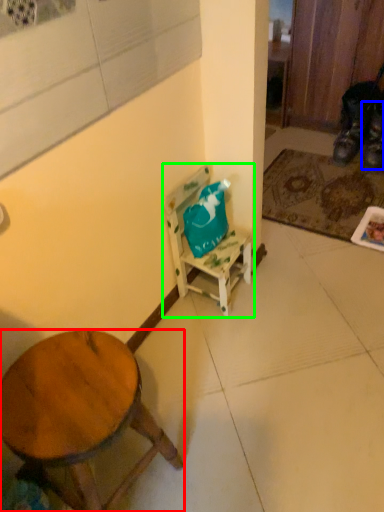
Question: Considering the real-world distances, which object is closest to desk (highlighted by a red box)? shoe (highlighted by a blue box) or chair (highlighted by a green box).

Choices:
 (A) shoe
 (B) chair

Answer: (B)